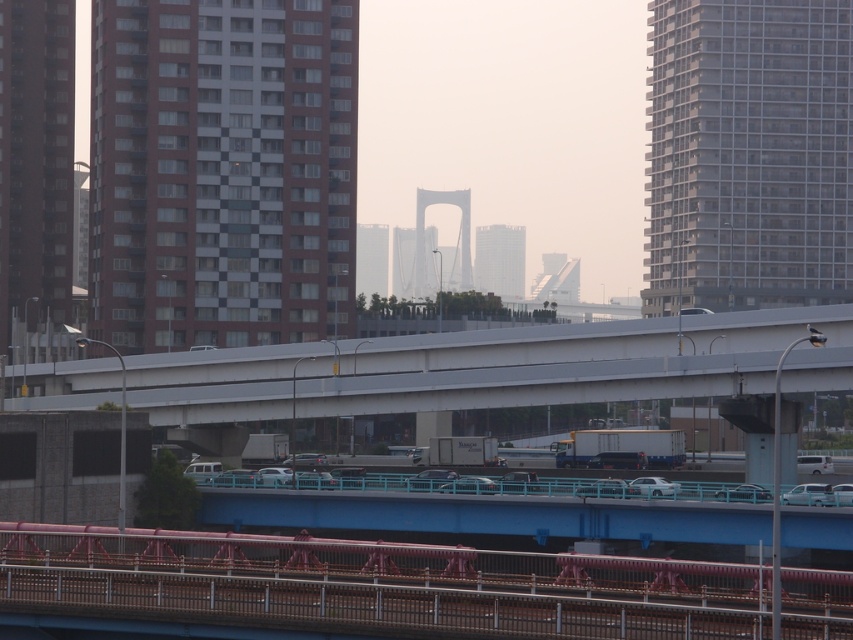
You are a photographer planning to capture both the gray glass building at upper right and the metallic silver sedan at lower right in a single frame. Based on their widths, will the building likely occupy more space in the photo compared to the sedan?

The gray glass building at upper right might be wider than metallic silver sedan at lower right, so it is likely to occupy more space in the photo compared to the sedan.

You are a city planner assessing the urban layout. Given the gray glass building at upper right and the metallic silver sedan at lower right, which object is taller?

The gray glass building at upper right is taller than the metallic silver sedan at lower right.

You are a drone operator trying to film the gray glass building at upper right and the brown textured building at left. From your current position, which building is closer to the ground?

The gray glass building at upper right is positioned under the brown textured building at left, so the gray glass building at upper right is closer to the ground.